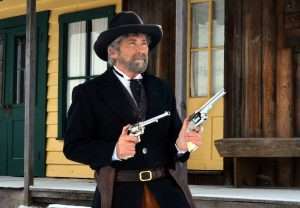
Image resolution: width=300 pixels, height=208 pixels. What are the coordinates of `wall` in the screenshot? It's located at (53, 41).